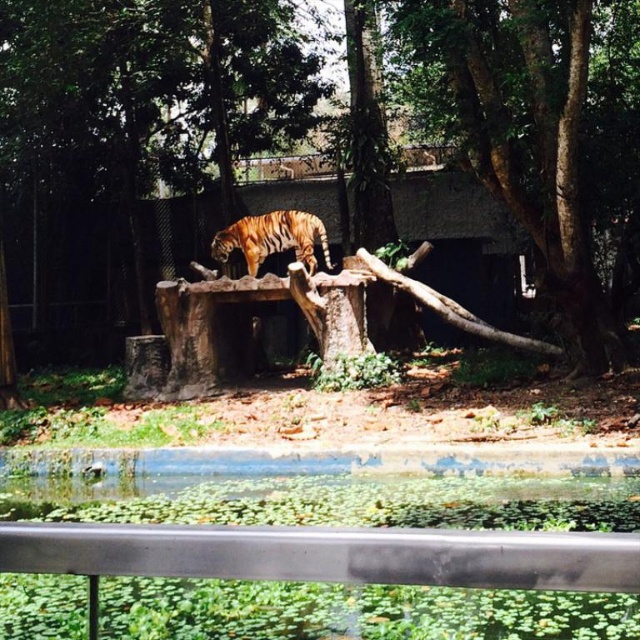
You are a zookeeper planning to install a new feeding station. You need to place it between the two points, point (573, 115) and point (216, 236). Which point should the feeding station be closer to so that it is in front of the other point from the tiger enclosure entrance?

The feeding station should be closer to point (216, 236) because point (573, 115) is in front of point (216, 236). To ensure the feeding station is in front of point (216, 236) from the entrance, it should be placed closer to point (216, 236).

From the picture: You are a zookeeper standing at the entrance of the enclosure. You need to place a new feeding tray for the tiger. The feeding tray requires a flat surface that is at least 5 meters away from the camera to ensure safety. Can the brown rough tree stump at center provide a suitable surface for this purpose?

The brown rough tree stump at center is 7.23 meters away from the camera, which exceeds the required 5 meters distance. Therefore, it can provide a suitable surface for placing the feeding tray safely.